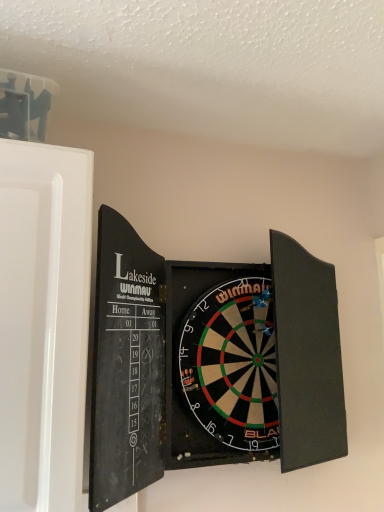
The image size is (384, 512). What do you see at coordinates (210, 362) in the screenshot?
I see `black wood dartboard at center` at bounding box center [210, 362].

This screenshot has height=512, width=384. What are the coordinates of `black wood dartboard at center` in the screenshot? It's located at (210, 362).

At what (x,y) coordinates should I click in order to perform the action: click on black wood dartboard at center. Please return your answer as a coordinate pair (x, y). The width and height of the screenshot is (384, 512). Looking at the image, I should click on (210, 362).